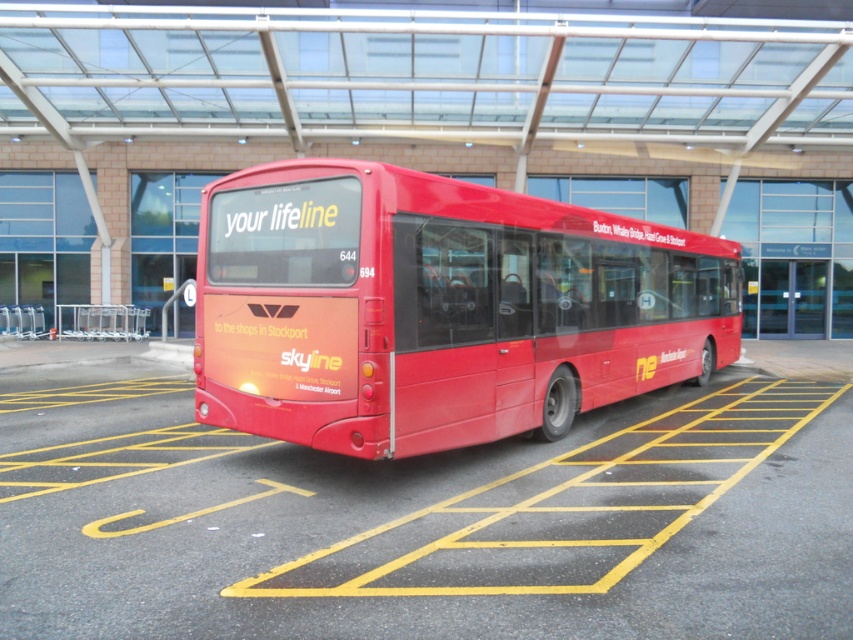
You are a delivery driver who needs to park your truck in the smooth asphalt parking lot at center. The truck is 2.5 meters wide. Can the matte red bus at center stay parked there without blocking your truck?

The smooth asphalt parking lot at center is wider than the matte red bus at center, so the bus can park there without blocking your truck as there is enough space.

You are standing on the sidewalk next to the smooth asphalt parking lot at center and the matte red bus at center. You want to cross the parking lot to reach the building entrance. Which direction should you walk relative to the bus to avoid the bus?

You should walk to the right of the matte red bus at center because the smooth asphalt parking lot at center is to the left of the matte red bus at center, so moving right would take you away from the parking lot and towards the building entrance.

You are a delivery person needing to park your van in the smooth asphalt parking lot at center. However, there is a matte red bus at center currently occupying the space. Based on the scene, can you drive your van into the parking lot without moving the bus?

The smooth asphalt parking lot at center is positioned under the matte red bus at center, which means the bus is parked on top of the parking lot. Since the bus is occupying the parking lot, you cannot drive your van into the parking lot without moving the bus.